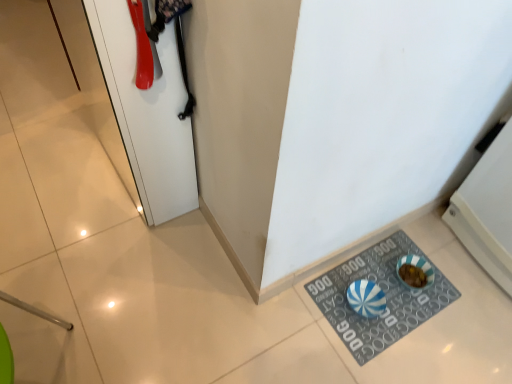
Question: In the image, is blue and white striped rubber mat at lower right on the left side or the right side of white glossy door at upper left?

Choices:
 (A) left
 (B) right

Answer: (B)

Question: Looking at their shapes, would you say blue and white striped rubber mat at lower right is wider or thinner than white glossy door at upper left?

Choices:
 (A) thin
 (B) wide

Answer: (B)

Question: From a real-world perspective, is blue and white striped rubber mat at lower right positioned above or below white glossy door at upper left?

Choices:
 (A) above
 (B) below

Answer: (B)

Question: From a real-world perspective, is white glossy door at upper left physically located above or below blue and white striped rubber mat at lower right?

Choices:
 (A) below
 (B) above

Answer: (B)

Question: Based on their sizes in the image, would you say white glossy door at upper left is bigger or smaller than blue and white striped rubber mat at lower right?

Choices:
 (A) big
 (B) small

Answer: (A)

Question: Choose the correct answer: Is white glossy door at upper left inside blue and white striped rubber mat at lower right or outside it?

Choices:
 (A) inside
 (B) outside

Answer: (B)

Question: Considering the positions of point (133, 157) and point (437, 294), is point (133, 157) closer or farther from the camera than point (437, 294)?

Choices:
 (A) farther
 (B) closer

Answer: (B)